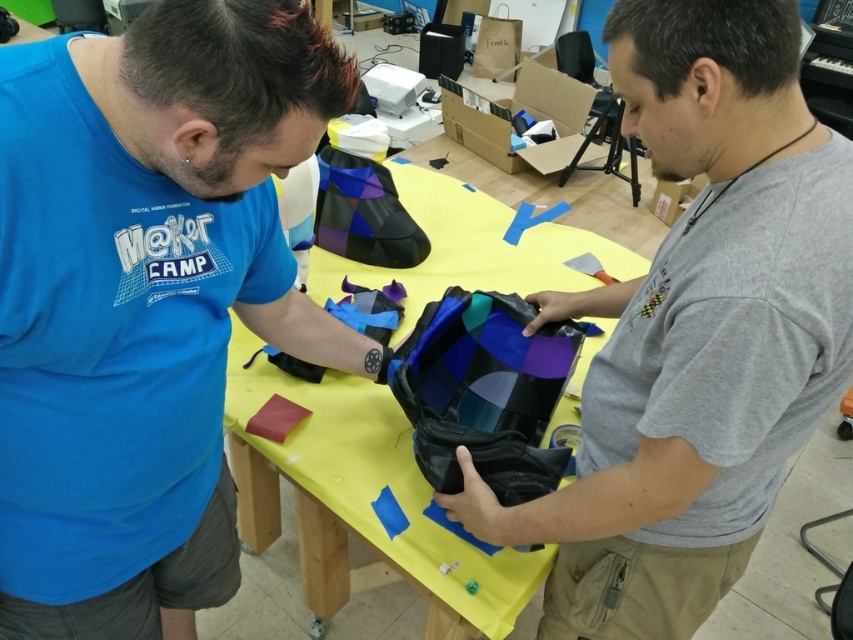
You are organizing a crafting event and need to place a new participant between the matte blue shirt at left and the yellow fabric table at center. Where should the new participant stand to be between them?

The new participant should stand to the right of the matte blue shirt at left and to the left of the yellow fabric table at center since the matte blue shirt at left is on the left side of the yellow fabric table at center.

You are standing at the table in the image and want to pick up an object. There are two points marked on the table surface, point 1 at coordinates point (675, 560) and point 2 at coordinates point (235, 380). Which point is closer to your current position?

Point (675, 560) is closer to the camera than point (235, 380), so if you are standing at the table, point (675, 560) would be closer to your current position.